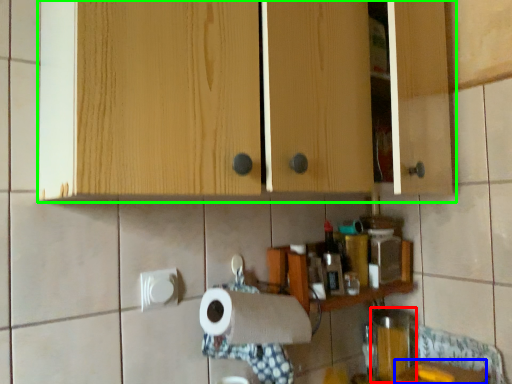
Question: Considering the real-world distances, which object is closest to appliance (highlighted by a red box)? counter top (highlighted by a blue box) or cabinetry (highlighted by a green box).

Choices:
 (A) counter top
 (B) cabinetry

Answer: (A)